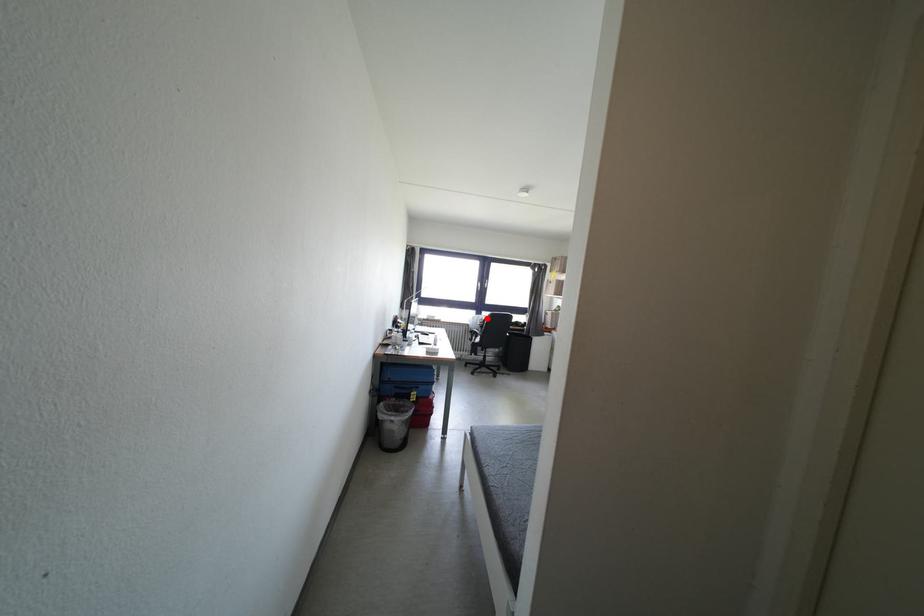
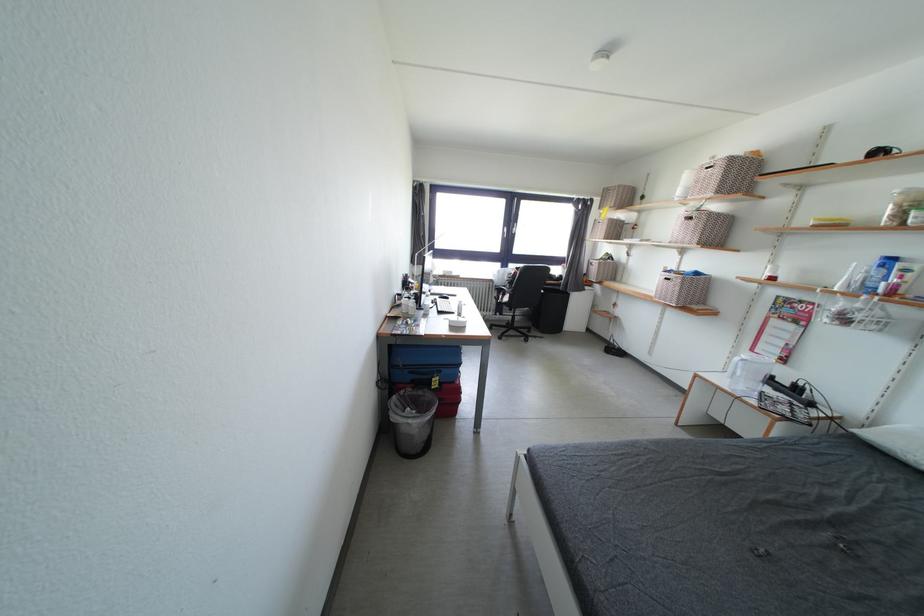
Question: I am providing you with two images of the same scene from different viewpoints. Given a red point in image1, look at the same physical point in image2. Is it:

Choices:
 (A) Closer to the viewpoint
 (B) Farther from the viewpoint

Answer: (A)